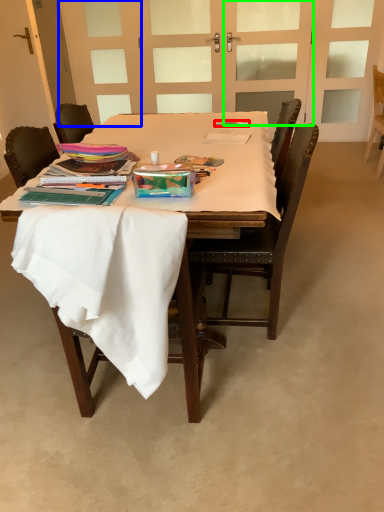
Question: Which object is the farthest from pen (highlighted by a red box)? Choose among these: door (highlighted by a blue box) or screen door (highlighted by a green box).

Choices:
 (A) door
 (B) screen door

Answer: (A)